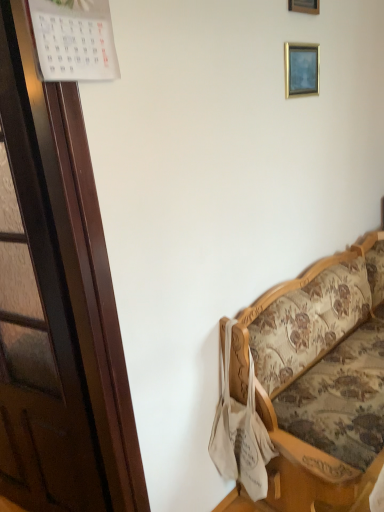
Question: From a real-world perspective, is wooden picture frame at upper center, acting as the 2th picture frame starting from the bottom, positioned over floral fabric couch at right based on gravity?

Choices:
 (A) yes
 (B) no

Answer: (A)

Question: From the image's perspective, is wooden picture frame at upper center, which is the first picture frame from top to bottom, located above floral fabric couch at right?

Choices:
 (A) yes
 (B) no

Answer: (A)

Question: Is wooden picture frame at upper center, acting as the 2th picture frame starting from the bottom, surrounding floral fabric couch at right?

Choices:
 (A) no
 (B) yes

Answer: (A)

Question: Is floral fabric couch at right at the back of wooden picture frame at upper center, acting as the 2th picture frame starting from the bottom?

Choices:
 (A) no
 (B) yes

Answer: (A)

Question: Considering the relative positions of wooden picture frame at upper center, which is the first picture frame from top to bottom, and floral fabric couch at right in the image provided, is wooden picture frame at upper center, which is the first picture frame from top to bottom, in front of floral fabric couch at right?

Choices:
 (A) yes
 (B) no

Answer: (B)

Question: From a real-world perspective, is wooden picture frame at upper center, which is the first picture frame from top to bottom, positioned above or below floral fabric couch at right?

Choices:
 (A) above
 (B) below

Answer: (A)

Question: In terms of size, does wooden picture frame at upper center, acting as the 2th picture frame starting from the bottom, appear bigger or smaller than floral fabric couch at right?

Choices:
 (A) small
 (B) big

Answer: (A)

Question: Is point (294, 4) positioned closer to the camera than point (299, 417)?

Choices:
 (A) closer
 (B) farther

Answer: (B)

Question: Is wooden picture frame at upper center, which is the first picture frame from top to bottom, situated inside floral fabric couch at right or outside?

Choices:
 (A) outside
 (B) inside

Answer: (A)

Question: From the image's perspective, is floral fabric couch at right located above or below wooden picture frame at upper center, which is the first picture frame from top to bottom?

Choices:
 (A) below
 (B) above

Answer: (A)

Question: From a real-world perspective, relative to wooden picture frame at upper center, acting as the 2th picture frame starting from the bottom, is floral fabric couch at right vertically above or below?

Choices:
 (A) below
 (B) above

Answer: (A)

Question: Is floral fabric couch at right in front of or behind wooden picture frame at upper center, acting as the 2th picture frame starting from the bottom, in the image?

Choices:
 (A) behind
 (B) front

Answer: (B)

Question: Is floral fabric couch at right spatially inside wooden picture frame at upper center, acting as the 2th picture frame starting from the bottom, or outside of it?

Choices:
 (A) inside
 (B) outside

Answer: (B)

Question: Is wooden picture frame at upper center, acting as the 2th picture frame starting from the bottom, taller or shorter than gold metallic picture frame at upper right, which is the 1th picture frame from bottom to top?

Choices:
 (A) tall
 (B) short

Answer: (A)

Question: Looking at their shapes, would you say wooden picture frame at upper center, acting as the 2th picture frame starting from the bottom, is wider or thinner than gold metallic picture frame at upper right, placed as the second picture frame when sorted from top to bottom?

Choices:
 (A) wide
 (B) thin

Answer: (B)